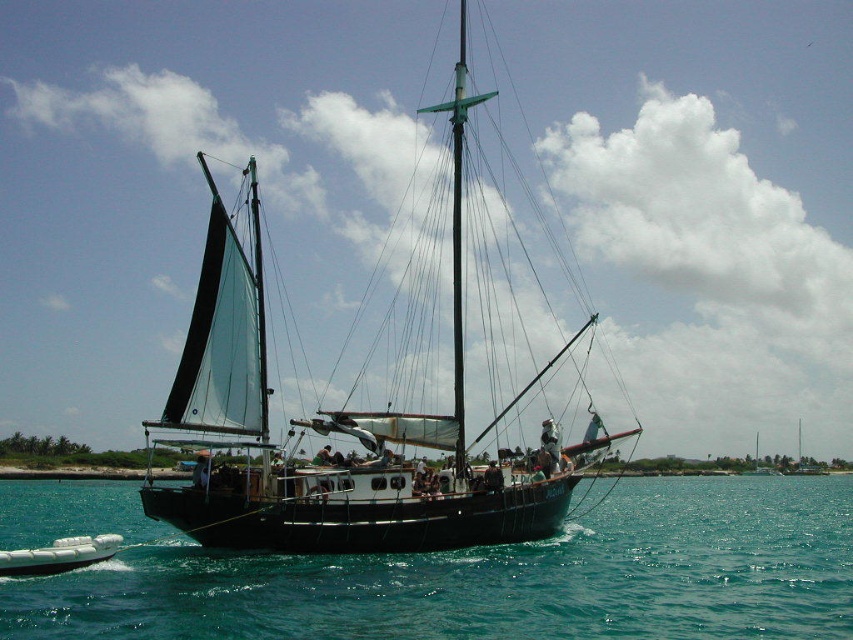
You are standing on the deck of the traditional sailing vessel and want to take a photo of two points on the deck. The first point is at coordinates point (381,556) and the second is at point (260,362). If you want to capture both points in a single frame without moving the camera, which point should you focus on to ensure both are in focus?

You should focus on point (260,362) because it is farther from the camera than point (381,556). By focusing on the farther point, the depth of field will include both points in the frame.